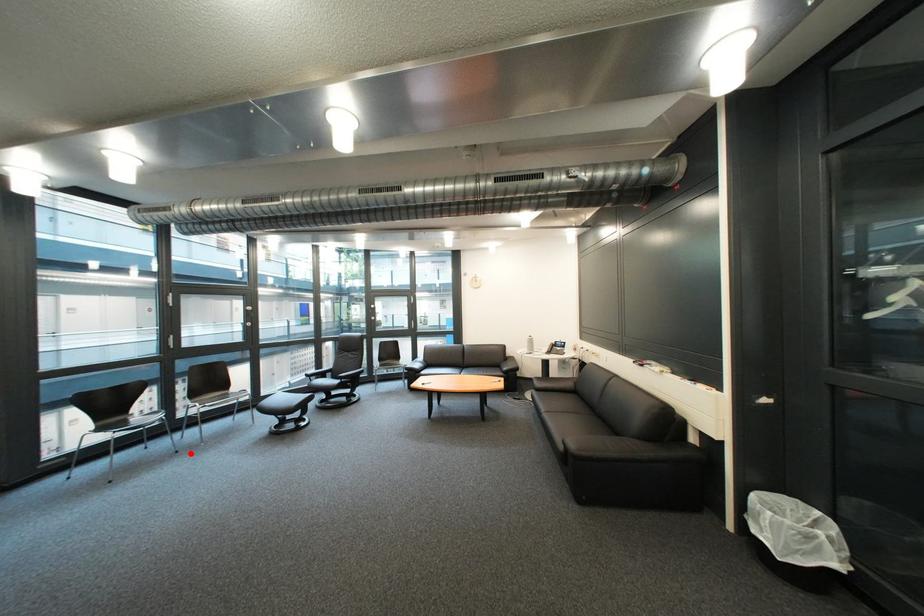
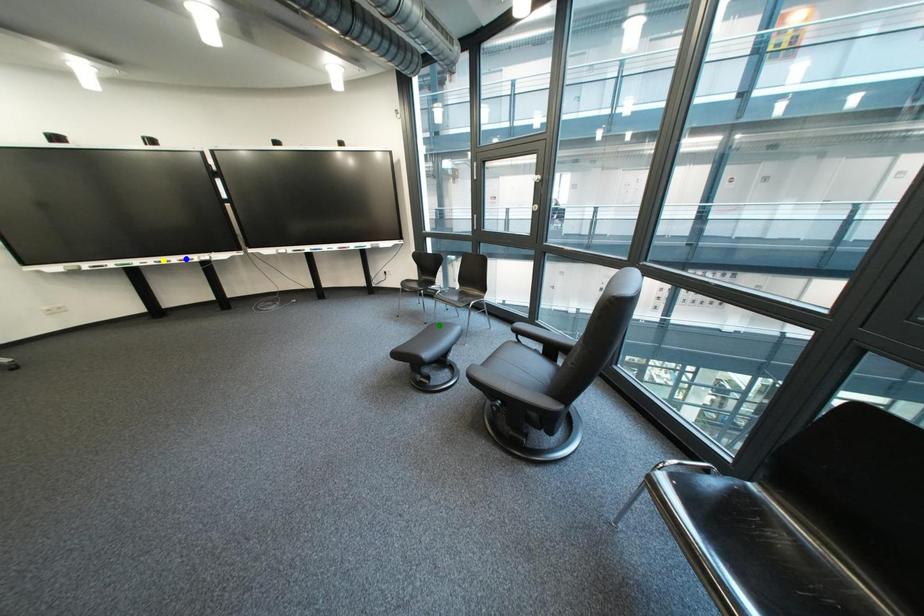
Question: I am providing you with two images of the same scene from different viewpoints. A red point is marked on the first image. You are given multiple points on the second image. Which mark in image 2 goes with the point in image 1?

Choices:
 (A) green point
 (B) yellow point
 (C) blue point

Answer: (A)